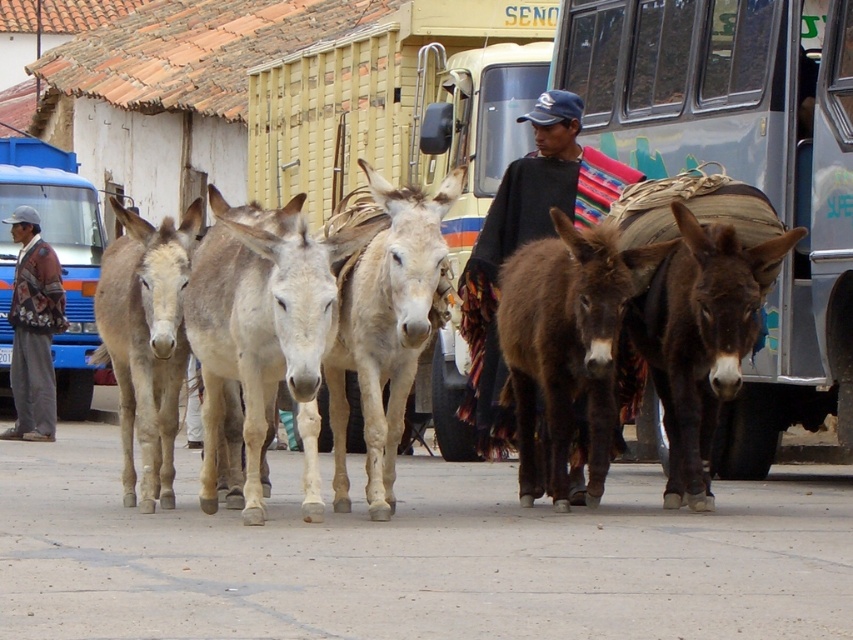
Question: Which point is closer to the camera?

Choices:
 (A) (509, 188)
 (B) (10, 330)
 (C) (47, 244)
 (D) (148, 465)

Answer: (D)

Question: Can you confirm if light beige fur at center is positioned above black woven poncho at center?

Choices:
 (A) no
 (B) yes

Answer: (A)

Question: Which of the following is the farthest from the observer?

Choices:
 (A) black woven poncho at center
 (B) light brown fur mule at left
 (C) light beige fur donkey at center

Answer: (B)

Question: Which of these objects is positioned closest to the light brown fur mule at left?

Choices:
 (A) floral-patterned jacket at left
 (B) light beige fur donkey at center
 (C) blue metallic bus at left
 (D) metallic silver bus at center

Answer: (B)

Question: Does light beige fur at center have a smaller size compared to light brown fur mule at left?

Choices:
 (A) no
 (B) yes

Answer: (A)

Question: Can you confirm if metallic silver bus at center is positioned to the right of black woven poncho at center?

Choices:
 (A) no
 (B) yes

Answer: (B)